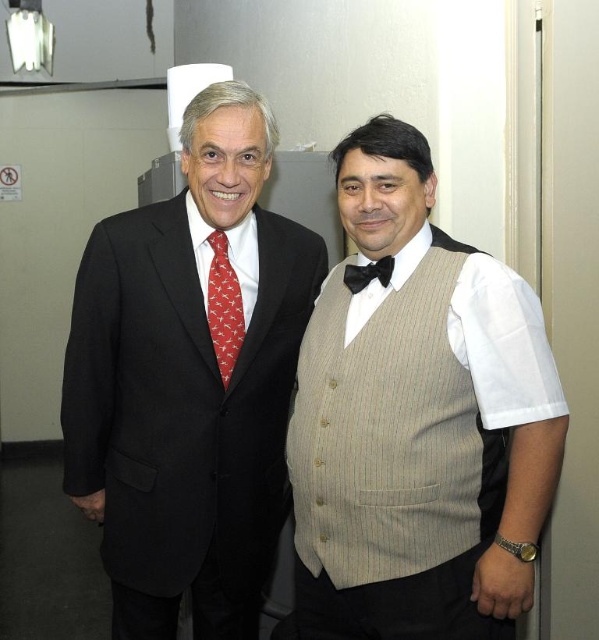
Question: Does tan pinstripe vest at center have a greater width compared to black satin bow tie at center?

Choices:
 (A) yes
 (B) no

Answer: (A)

Question: Which object is positioned farthest from the matte black suit at left?

Choices:
 (A) black satin bow tie at center
 (B) tan pinstripe vest at center

Answer: (A)

Question: Is beige striped vest at center positioned in front of red silk tie at center?

Choices:
 (A) no
 (B) yes

Answer: (B)

Question: Considering the real-world distances, which object is farthest from the beige striped vest at center?

Choices:
 (A) red silk tie at center
 (B) matte black suit at left

Answer: (A)

Question: Does matte black suit at left come in front of red silk tie at center?

Choices:
 (A) yes
 (B) no

Answer: (A)

Question: Which object is the farthest from the beige striped vest at center?

Choices:
 (A) tan pinstripe vest at center
 (B) black satin bow tie at center
 (C) red silk tie at center

Answer: (C)